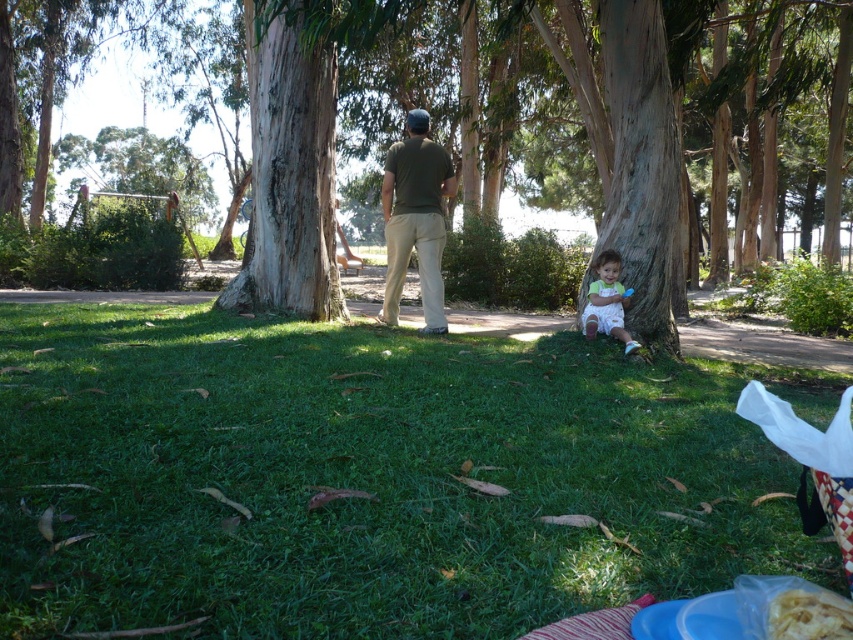
In the scene shown: Does green grass at lower center have a larger size compared to white crinkled paper at lower right?

Yes, green grass at lower center is bigger than white crinkled paper at lower right.

Is green grass at lower center shorter than white crinkled paper at lower right?

Incorrect, green grass at lower center's height does not fall short of white crinkled paper at lower right's.

Locate an element on the screen. This screenshot has width=853, height=640. green grass at lower center is located at coordinates pyautogui.click(x=370, y=476).

The height and width of the screenshot is (640, 853). What are the coordinates of `green grass at lower center` in the screenshot? It's located at (370, 476).

Between green matte shirt at center and white crinkled paper at lower right, which one appears on the left side from the viewer's perspective?

Positioned to the left is green matte shirt at center.

From the picture: Between green matte shirt at center and white crinkled paper at lower right, which one is positioned lower?

Positioned lower is white crinkled paper at lower right.

Which is in front, point (390, 168) or point (786, 604)?

Point (786, 604) is more forward.

Identify the location of green matte shirt at center. The image size is (853, 640). (415, 218).

Who is taller, green grass at lower center or light green fabric baby at lower right?

Standing taller between the two is light green fabric baby at lower right.

What do you see at coordinates (370, 476) in the screenshot?
I see `green grass at lower center` at bounding box center [370, 476].

You are a GUI agent. You are given a task and a screenshot of the screen. Output one action in this format:
    pyautogui.click(x=<x>, y=<y>)
    Task: Click on the green grass at lower center
    The height and width of the screenshot is (640, 853).
    Given the screenshot: What is the action you would take?
    pyautogui.click(x=370, y=476)